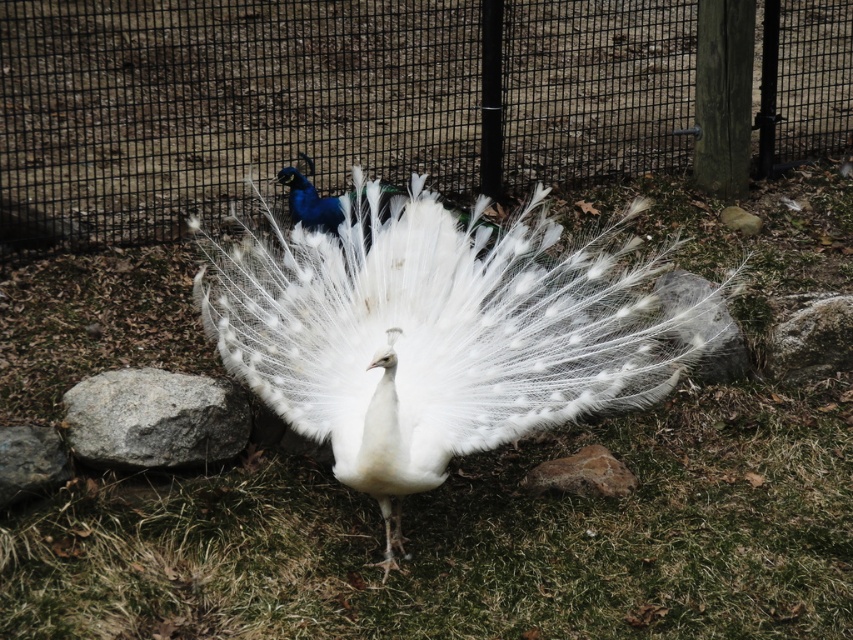
Question: Can you confirm if gray rough rock at center-right is bigger than brown rough rock at lower center?

Choices:
 (A) yes
 (B) no

Answer: (A)

Question: Which point is farther to the camera?

Choices:
 (A) (538, 468)
 (B) (299, 324)
 (C) (16, 483)

Answer: (A)

Question: Among these objects, which one is nearest to the camera?

Choices:
 (A) gray rough rock at lower left
 (B) gray rough rock at center-right

Answer: (A)

Question: Which object appears closest to the camera in this image?

Choices:
 (A) gray rough rock at lower left
 (B) gray rough rock at center-right
 (C) gray rock at lower left

Answer: (C)

Question: Can you confirm if white feathered peacock at center is smaller than gray rock at lower left?

Choices:
 (A) yes
 (B) no

Answer: (B)

Question: From the image, what is the correct spatial relationship of white feathered peacock at center in relation to gray rough rock at lower left?

Choices:
 (A) above
 (B) below

Answer: (A)